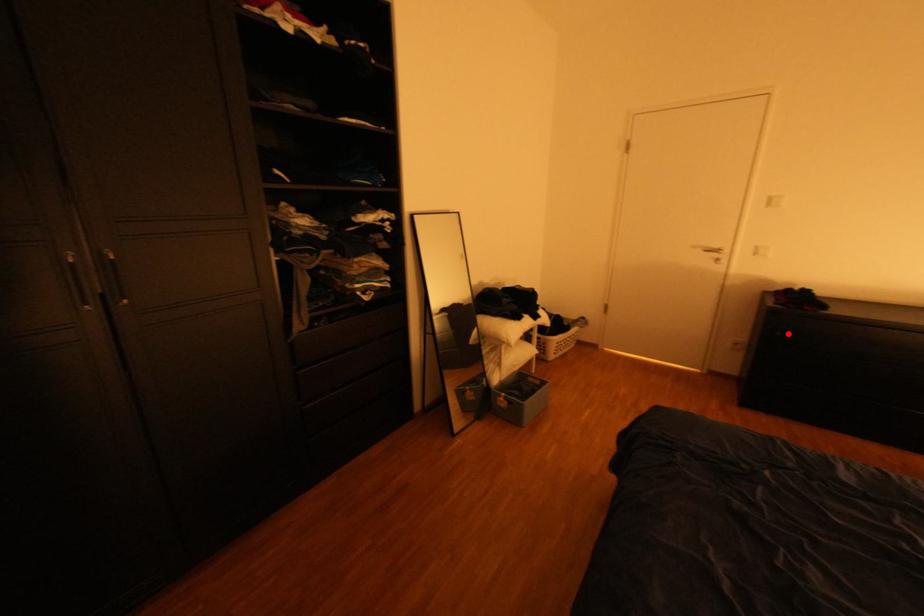
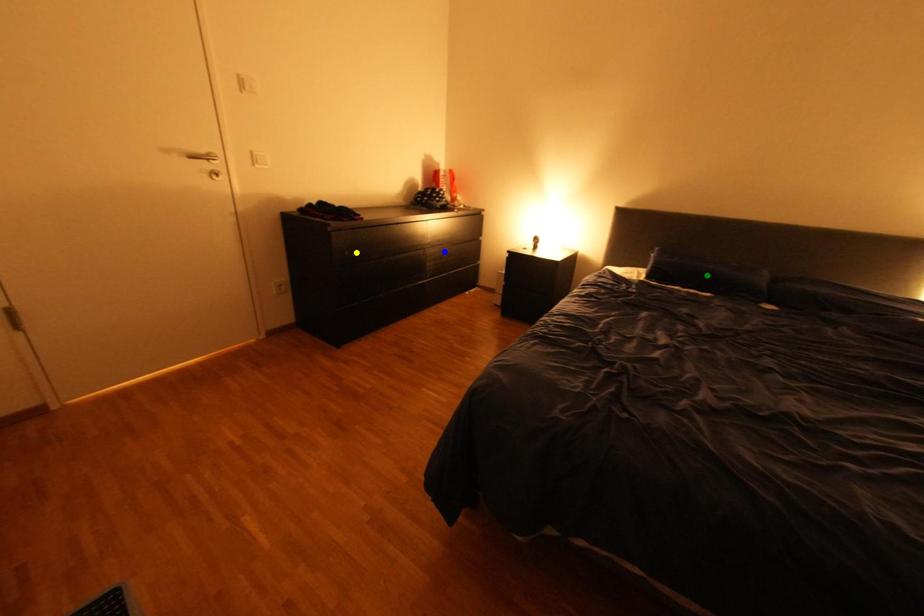
Question: I am providing you with two images of the same scene from different viewpoints. A red point is marked on the first image. You are given multiple points on the second image. Can you choose the point in image 2 that corresponds to the point in image 1?

Choices:
 (A) green point
 (B) yellow point
 (C) blue point

Answer: (B)